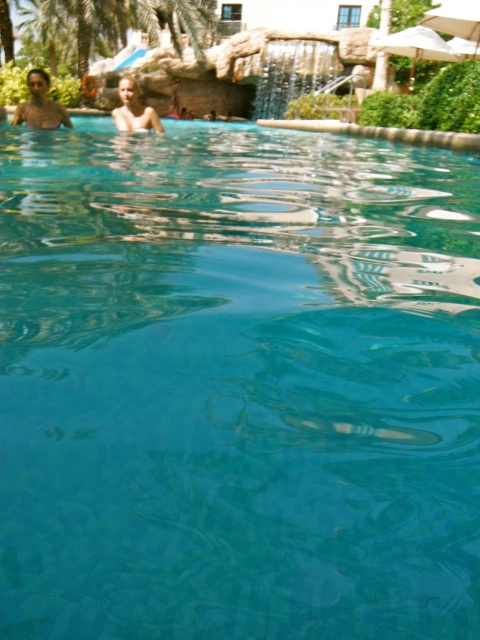
Question: Among these objects, which one is farthest from the camera?

Choices:
 (A) blonde hair human at upper left
 (B) matte skin at upper left

Answer: (B)

Question: Does matte skin at upper left have a greater width compared to blonde hair human at upper left?

Choices:
 (A) no
 (B) yes

Answer: (A)

Question: Can you confirm if matte skin at upper left is thinner than blonde hair human at upper left?

Choices:
 (A) yes
 (B) no

Answer: (A)

Question: Can you confirm if matte skin at upper left is positioned to the left of blonde hair human at upper left?

Choices:
 (A) yes
 (B) no

Answer: (A)

Question: Which of the following is the farthest from the observer?

Choices:
 (A) blonde hair human at upper left
 (B) matte skin at upper left

Answer: (B)